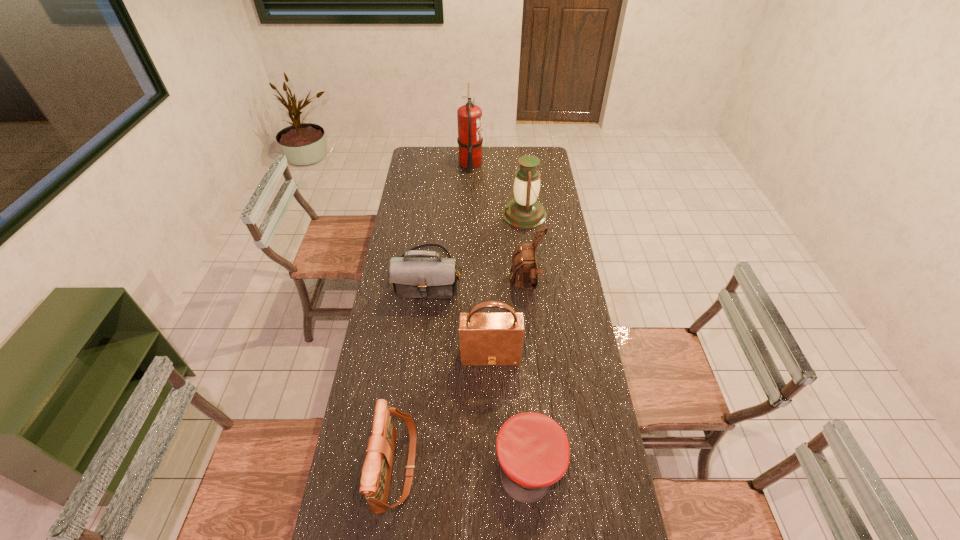
Locate an element on the screen. The height and width of the screenshot is (540, 960). fire extinguisher is located at coordinates (469, 117).

The image size is (960, 540). I want to click on the farthest object, so tap(469, 117).

Image resolution: width=960 pixels, height=540 pixels. Identify the location of lantern. (525, 212).

At what (x,y) coordinates should I click in order to perform the action: click on the second nearest shoulder bag. Please return your answer as a coordinate pair (x, y). This screenshot has width=960, height=540. Looking at the image, I should click on (486, 338).

The width and height of the screenshot is (960, 540). Find the location of `the nearest shoulder bag`. the nearest shoulder bag is located at coordinates (376, 473).

Locate an element on the screen. This screenshot has height=540, width=960. cap is located at coordinates (533, 451).

I want to click on free region located 0.200m toward the nozzle of the tallest object, so click(519, 163).

Where is `vacant area located with the light compartment facing forward on the lantern`? vacant area located with the light compartment facing forward on the lantern is located at coordinates (425, 215).

Identify the location of free space located 0.250m with the light compartment facing forward on the lantern. (450, 215).

This screenshot has width=960, height=540. Find the location of `free space located with the light compartment facing forward on the lantern`. free space located with the light compartment facing forward on the lantern is located at coordinates (477, 215).